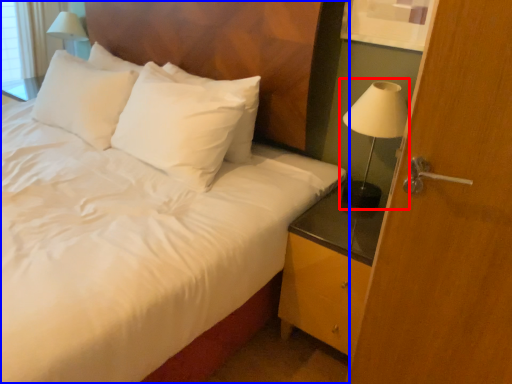
Question: Which object is further to the camera taking this photo, bedside lamp (highlighted by a red box) or bed (highlighted by a blue box)?

Choices:
 (A) bedside lamp
 (B) bed

Answer: (A)